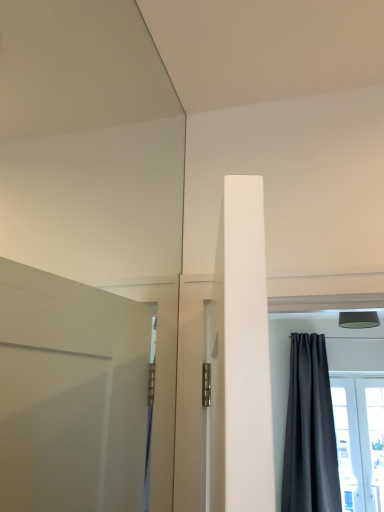
What do you see at coordinates (360, 441) in the screenshot? The width and height of the screenshot is (384, 512). I see `transparent glass door at lower right` at bounding box center [360, 441].

I want to click on transparent glass door at lower right, so click(x=360, y=441).

What do you see at coordinates (310, 431) in the screenshot? The height and width of the screenshot is (512, 384). I see `dark gray matte curtain at right` at bounding box center [310, 431].

Locate an element on the screen. The image size is (384, 512). dark gray matte curtain at right is located at coordinates tap(310, 431).

Image resolution: width=384 pixels, height=512 pixels. I want to click on transparent glass door at lower right, so click(x=360, y=441).

In the scene shown: Which object is positioned more to the left, transparent glass door at lower right or dark gray matte curtain at right?

dark gray matte curtain at right.

Which object is further away from the camera taking this photo, transparent glass door at lower right or dark gray matte curtain at right?

transparent glass door at lower right is more distant.

Is point (350, 401) closer to camera compared to point (314, 353)?

Yes, it is in front of point (314, 353).

From the image's perspective, which one is positioned lower, transparent glass door at lower right or dark gray matte curtain at right?

transparent glass door at lower right appears lower in the image.

From a real-world perspective, is transparent glass door at lower right over dark gray matte curtain at right?

No, from a real-world perspective, transparent glass door at lower right is not over dark gray matte curtain at right

Looking at their sizes, would you say transparent glass door at lower right is wider or thinner than dark gray matte curtain at right?

In the image, transparent glass door at lower right appears to be more narrow than dark gray matte curtain at right.

Can you confirm if transparent glass door at lower right is shorter than dark gray matte curtain at right?

Yes.

Based on their sizes in the image, would you say transparent glass door at lower right is bigger or smaller than dark gray matte curtain at right?

transparent glass door at lower right is smaller than dark gray matte curtain at right.

Is transparent glass door at lower right outside of dark gray matte curtain at right?

Absolutely, transparent glass door at lower right is external to dark gray matte curtain at right.

Is transparent glass door at lower right directly adjacent to dark gray matte curtain at right?

transparent glass door at lower right and dark gray matte curtain at right are not in contact.

Is transparent glass door at lower right turned away from dark gray matte curtain at right?

transparent glass door at lower right is not turned away from dark gray matte curtain at right.

Image resolution: width=384 pixels, height=512 pixels. In order to click on curtain positioned vertically above the transparent glass door at lower right (from a real-world perspective) in this screenshot , I will do `click(310, 431)`.

Looking at this image, considering the positions of objects dark gray matte curtain at right and transparent glass door at lower right in the image provided, who is more to the right, dark gray matte curtain at right or transparent glass door at lower right?

transparent glass door at lower right.

Considering the relative positions of dark gray matte curtain at right and transparent glass door at lower right in the image provided, is dark gray matte curtain at right behind transparent glass door at lower right?

No, dark gray matte curtain at right is closer to the camera.

Considering the points (327, 446) and (371, 452), which point is in front, point (327, 446) or point (371, 452)?

The point (327, 446) is closer.

From the image's perspective, is dark gray matte curtain at right positioned above or below transparent glass door at lower right?

dark gray matte curtain at right is above transparent glass door at lower right.

From a real-world perspective, is dark gray matte curtain at right physically below transparent glass door at lower right?

No, from a real-world perspective, dark gray matte curtain at right is not below transparent glass door at lower right.

Which of these two, dark gray matte curtain at right or transparent glass door at lower right, is wider?

Wider between the two is dark gray matte curtain at right.

Considering the relative sizes of dark gray matte curtain at right and transparent glass door at lower right in the image provided, is dark gray matte curtain at right shorter than transparent glass door at lower right?

No, dark gray matte curtain at right is not shorter than transparent glass door at lower right.

Does dark gray matte curtain at right have a larger size compared to transparent glass door at lower right?

Yes, dark gray matte curtain at right is bigger than transparent glass door at lower right.

Is dark gray matte curtain at right surrounding transparent glass door at lower right?

No, transparent glass door at lower right is located outside of dark gray matte curtain at right.

Is dark gray matte curtain at right next to transparent glass door at lower right?

dark gray matte curtain at right and transparent glass door at lower right are not in contact.

Is transparent glass door at lower right at the back of dark gray matte curtain at right?

No, dark gray matte curtain at right's orientation is not away from transparent glass door at lower right.

Based on the photo, what's the angular difference between dark gray matte curtain at right and transparent glass door at lower right's facing directions?

0.293 degrees.

Measure the distance from dark gray matte curtain at right to transparent glass door at lower right.

A distance of 11.83 inches exists between dark gray matte curtain at right and transparent glass door at lower right.

Find the location of a particular element. The image size is (384, 512). curtain above the transparent glass door at lower right (from the image's perspective) is located at coordinates click(x=310, y=431).

Find the location of a particular element. This screenshot has height=512, width=384. curtain in front of the transparent glass door at lower right is located at coordinates (310, 431).

Where is `curtain above the transparent glass door at lower right (from the image's perspective)`? The height and width of the screenshot is (512, 384). curtain above the transparent glass door at lower right (from the image's perspective) is located at coordinates pyautogui.click(x=310, y=431).